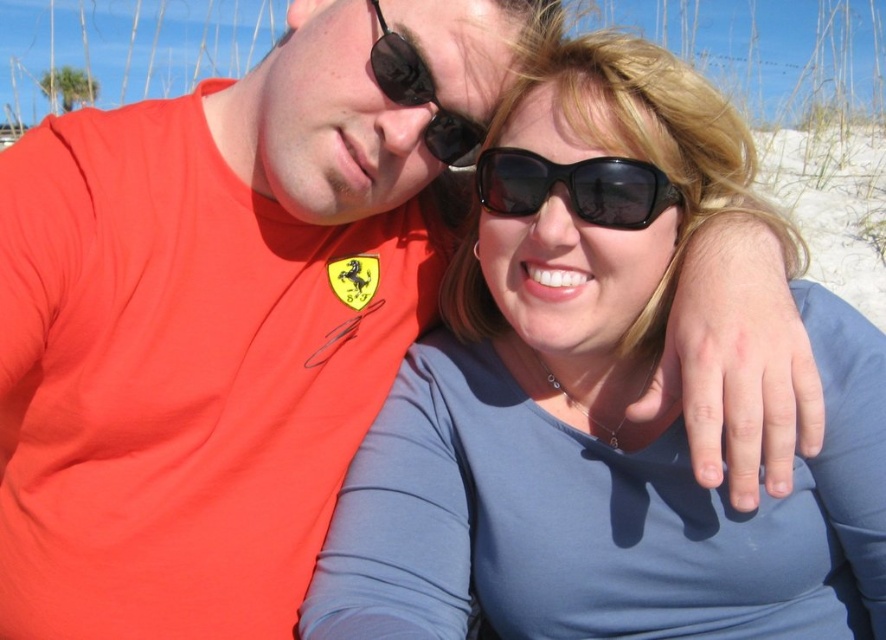
You are a photographer standing at the beach and want to take a clear photo of the matte blue shirt at center. What is the minimum distance you need to be from the camera to ensure the shirt is in focus?

The matte blue shirt at center is 1.35 meters away from the camera, so the minimum distance required to ensure it is in focus is 1.35 meters.

You are a photographer trying to capture a candid shot of the two people in the scene. You want to ensure that both the matte blue shirt at center and the black plastic sunglasses at center are in focus. Given that your camera has a depth of field that can sharply focus objects within a 10 inch range, will both items be in focus?

The matte blue shirt at center is 10.23 inches away from the black plastic sunglasses at center. Since the distance between them exceeds the camera lens depth of field range of 10 inches, it would be challenging to have both items in focus simultaneously.

Looking at this image, you are a photographer trying to capture a candid shot of the matte blue shirt at center and the black rubber sunglasses at upper center. Since you want to ensure both subjects are in focus, you need to know their spatial relationship. Which object is positioned to the right of the other?

The matte blue shirt at center is to the right of the black rubber sunglasses at upper center.